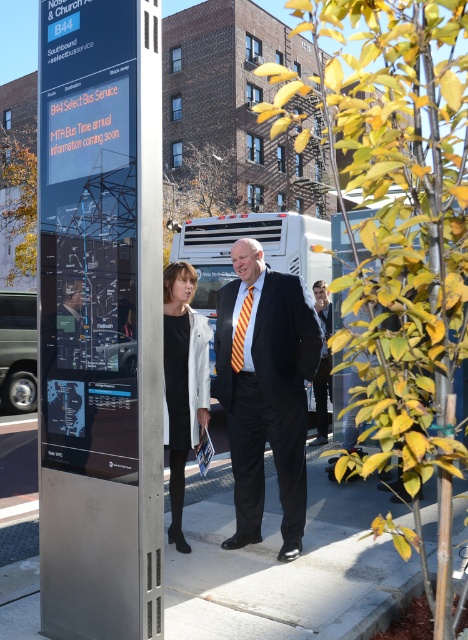
Question: Does white concrete pavement at center have a smaller size compared to matte black suit at center?

Choices:
 (A) yes
 (B) no

Answer: (A)

Question: Which object appears closest to the camera in this image?

Choices:
 (A) matte black suit at center
 (B) white matte coat at center
 (C) metallic digital display at center
 (D) yellow striped tie at center

Answer: (C)

Question: Is white matte coat at center wider than dark gray suit at center?

Choices:
 (A) yes
 (B) no

Answer: (B)

Question: Which object appears farthest from the camera in this image?

Choices:
 (A) white matte coat at center
 (B) matte black suit at center
 (C) dark gray suit at center
 (D) metallic digital display at center

Answer: (C)

Question: Among these points, which one is nearest to the camera?

Choices:
 (A) (158, 476)
 (B) (248, 522)
 (C) (322, 406)
 (D) (184, 276)

Answer: (A)

Question: Is white concrete pavement at center wider than yellow striped tie at center?

Choices:
 (A) yes
 (B) no

Answer: (A)